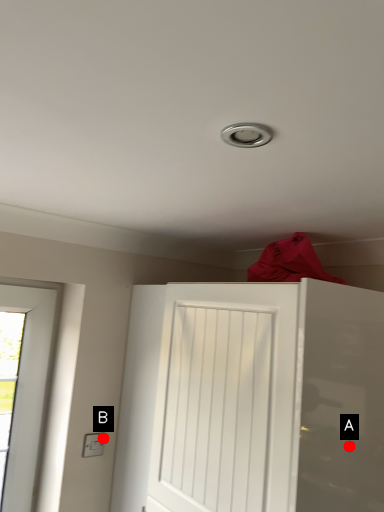
Question: Two points are circled on the image, labeled by A and B beside each circle. Which of the following is the closest to the observer?

Choices:
 (A) A is closer
 (B) B is closer

Answer: (A)